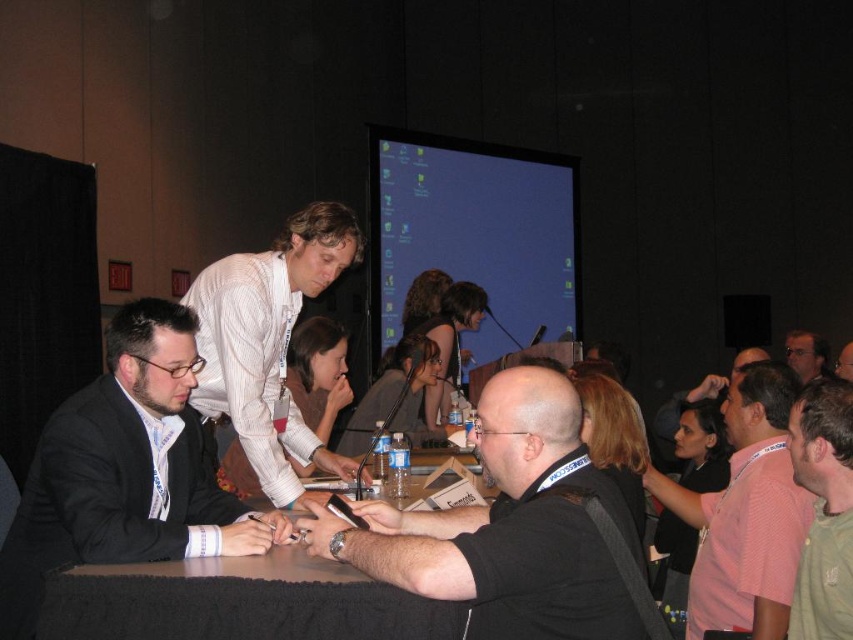
Question: Considering the relative positions of black matte suit at left and white striped shirt at center in the image provided, where is black matte suit at left located with respect to white striped shirt at center?

Choices:
 (A) right
 (B) left

Answer: (B)

Question: Which point is farther to the camera?

Choices:
 (A) black matte suit at left
 (B) white striped shirt at center
 (C) matte black shirt at center

Answer: (C)

Question: Among these objects, which one is farthest from the camera?

Choices:
 (A) smooth white table at center
 (B) green textured shirt at right

Answer: (B)

Question: Can you confirm if black matte shirt at center is positioned above white striped shirt at center?

Choices:
 (A) yes
 (B) no

Answer: (B)

Question: Which point is closer to the camera?

Choices:
 (A) matte black shirt at center
 (B) black matte shirt at center
 (C) pink cotton shirt at right
 (D) black matte suit at left

Answer: (B)

Question: Is black matte shirt at center thinner than smooth white table at center?

Choices:
 (A) yes
 (B) no

Answer: (A)